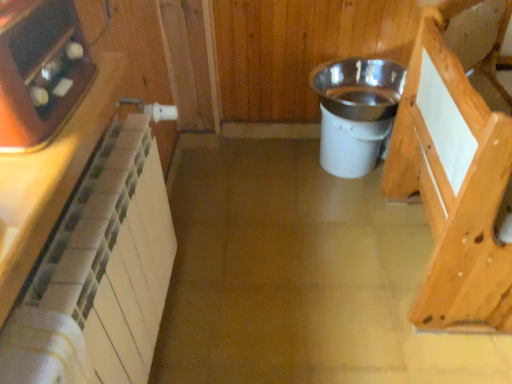
Question: Would you say matte black tray at upper left, the 2th appliance from the right, contains white tile cabinetry at left, placed as the second cabinetry when sorted from right to left?

Choices:
 (A) no
 (B) yes

Answer: (A)

Question: Can you confirm if matte black tray at upper left, arranged as the second appliance when viewed from the back, is positioned to the left of white tile cabinetry at left, placed as the 1th cabinetry when sorted from front to back?

Choices:
 (A) no
 (B) yes

Answer: (B)

Question: Can you confirm if matte black tray at upper left, acting as the first appliance starting from the front, is taller than white tile cabinetry at left, placed as the 1th cabinetry when sorted from front to back?

Choices:
 (A) yes
 (B) no

Answer: (A)

Question: Is there a large distance between matte black tray at upper left, the 2th appliance from the right, and white tile cabinetry at left, placed as the second cabinetry when sorted from right to left?

Choices:
 (A) yes
 (B) no

Answer: (B)

Question: Does matte black tray at upper left, arranged as the second appliance when viewed from the back, have a lesser width compared to white tile cabinetry at left, placed as the 1th cabinetry when sorted from front to back?

Choices:
 (A) yes
 (B) no

Answer: (A)

Question: Does point (352, 94) appear closer or farther from the camera than point (485, 251)?

Choices:
 (A) farther
 (B) closer

Answer: (A)

Question: From the image's perspective, is white plastic bucket at center, marked as the 1th appliance in a right-to-left arrangement, above or below light brown wood at right, acting as the 2th cabinetry starting from the front?

Choices:
 (A) above
 (B) below

Answer: (A)

Question: Would you say white plastic bucket at center, the second appliance in the left-to-right sequence, is to the left or to the right of light brown wood at right, which ranks as the second cabinetry in left-to-right order, in the picture?

Choices:
 (A) right
 (B) left

Answer: (B)

Question: From a real-world perspective, relative to light brown wood at right, which ranks as the second cabinetry in left-to-right order, is white plastic bucket at center, the second appliance in the left-to-right sequence, vertically above or below?

Choices:
 (A) above
 (B) below

Answer: (B)

Question: In terms of size, does white plastic bucket at center, the second appliance in the left-to-right sequence, appear bigger or smaller than matte black tray at upper left, arranged as the second appliance when viewed from the back?

Choices:
 (A) small
 (B) big

Answer: (B)

Question: Is white plastic bucket at center, which is counted as the 1th appliance, starting from the back, taller or shorter than matte black tray at upper left, arranged as the first appliance when viewed from the left?

Choices:
 (A) short
 (B) tall

Answer: (B)

Question: In the image, is white plastic bucket at center, the 2th appliance when ordered from front to back, positioned in front of or behind matte black tray at upper left, the 2th appliance from the right?

Choices:
 (A) behind
 (B) front

Answer: (A)

Question: From a real-world perspective, relative to matte black tray at upper left, arranged as the second appliance when viewed from the back, is white plastic bucket at center, the 2th appliance when ordered from front to back, vertically above or below?

Choices:
 (A) above
 (B) below

Answer: (B)

Question: From the image's perspective, is light brown wood at right, acting as the 2th cabinetry starting from the front, positioned above or below white tile cabinetry at left, which ranks as the second cabinetry in back-to-front order?

Choices:
 (A) below
 (B) above

Answer: (B)

Question: Looking at the image, does light brown wood at right, acting as the 2th cabinetry starting from the front, seem bigger or smaller compared to white tile cabinetry at left, which ranks as the second cabinetry in back-to-front order?

Choices:
 (A) big
 (B) small

Answer: (A)